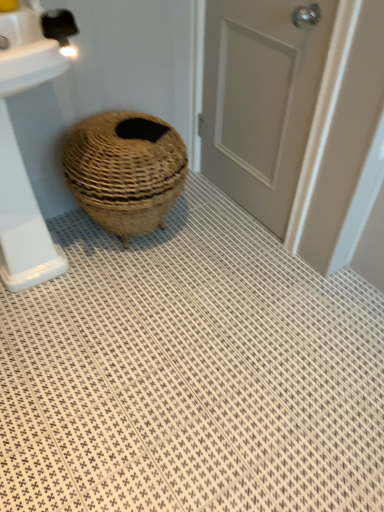
Question: Does white glossy sink at left have a smaller size compared to natural woven basket at center?

Choices:
 (A) no
 (B) yes

Answer: (A)

Question: Is white glossy sink at left facing towards natural woven basket at center?

Choices:
 (A) yes
 (B) no

Answer: (B)

Question: Considering the relative positions of white glossy sink at left and natural woven basket at center in the image provided, is white glossy sink at left to the right of natural woven basket at center from the viewer's perspective?

Choices:
 (A) no
 (B) yes

Answer: (A)

Question: Is white glossy sink at left positioned behind natural woven basket at center?

Choices:
 (A) no
 (B) yes

Answer: (A)

Question: Is white glossy sink at left bigger than natural woven basket at center?

Choices:
 (A) yes
 (B) no

Answer: (A)

Question: In terms of height, does white glossy sink at left look taller or shorter compared to matte gray door at center?

Choices:
 (A) short
 (B) tall

Answer: (A)

Question: Is white glossy sink at left to the left or to the right of matte gray door at center in the image?

Choices:
 (A) left
 (B) right

Answer: (A)

Question: From a real-world perspective, relative to matte gray door at center, is white glossy sink at left vertically above or below?

Choices:
 (A) below
 (B) above

Answer: (A)

Question: Relative to matte gray door at center, is white glossy sink at left in front or behind?

Choices:
 (A) front
 (B) behind

Answer: (A)

Question: Is white textured bath mat at center spatially inside white glossy sink at left, or outside of it?

Choices:
 (A) outside
 (B) inside

Answer: (A)

Question: Is white textured bath mat at center taller or shorter than white glossy sink at left?

Choices:
 (A) tall
 (B) short

Answer: (B)

Question: Is point (119, 501) positioned closer to the camera than point (19, 287)?

Choices:
 (A) closer
 (B) farther

Answer: (A)

Question: Is white textured bath mat at center in front of or behind white glossy sink at left in the image?

Choices:
 (A) front
 (B) behind

Answer: (A)

Question: Is point (18, 228) closer or farther from the camera than point (248, 227)?

Choices:
 (A) farther
 (B) closer

Answer: (B)

Question: From a real-world perspective, is white glossy sink at left physically located above or below white textured bath mat at center?

Choices:
 (A) below
 (B) above

Answer: (B)